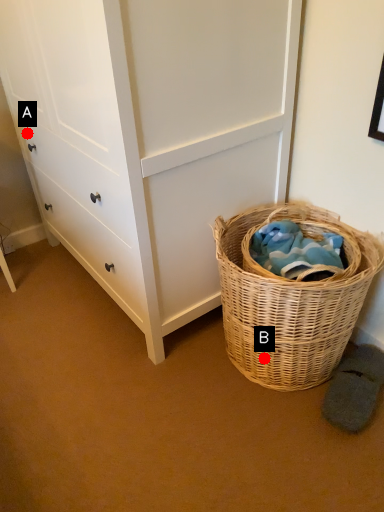
Question: Two points are circled on the image, labeled by A and B beside each circle. Which of the following is the farthest from the observer?

Choices:
 (A) A is further
 (B) B is further

Answer: (A)